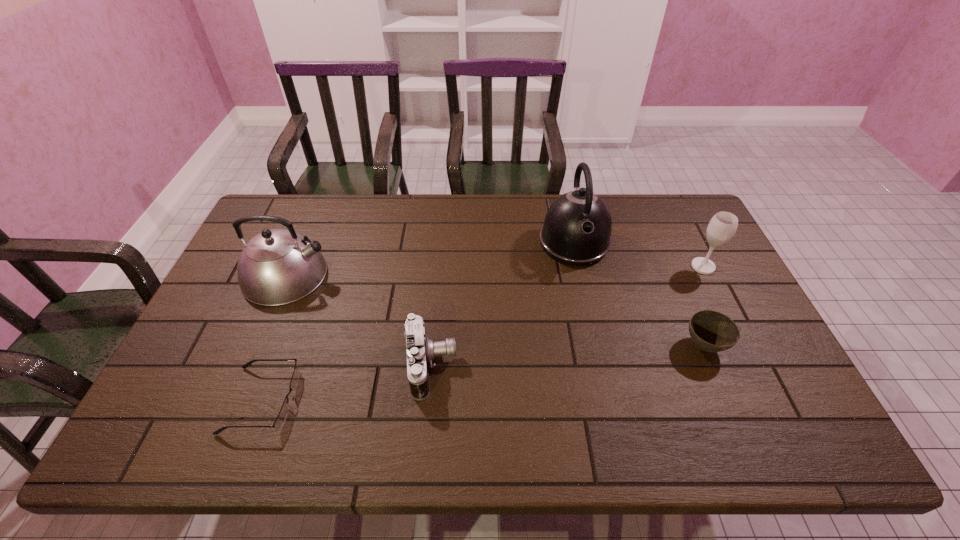
In order to click on vacant space situated 0.400m on the spout of the taller kettle in this screenshot , I will do `click(606, 385)`.

Locate an element on the screen. This screenshot has width=960, height=540. vacant space located 0.180m from the spout of the left kettle is located at coordinates (389, 275).

Where is `vacant space situated 0.110m on the front of the rightmost object`? This screenshot has height=540, width=960. vacant space situated 0.110m on the front of the rightmost object is located at coordinates (721, 302).

In order to click on vacant region located at the lens of the camera in this screenshot , I will do `click(476, 366)`.

Locate an element on the screen. This screenshot has width=960, height=540. blank area located 0.340m on the left of the bowl is located at coordinates (553, 346).

You are a GUI agent. You are given a task and a screenshot of the screen. Output one action in this format:
    pyautogui.click(x=<x>, y=<y>)
    Task: Click on the vacant space located on the front-facing side of the shortest object
    The width and height of the screenshot is (960, 540).
    Given the screenshot: What is the action you would take?
    pyautogui.click(x=316, y=400)

What are the coordinates of `object present at the far edge` in the screenshot? It's located at (577, 228).

Locate an element on the screen. This screenshot has width=960, height=540. object that is at the near edge is located at coordinates (282, 416).

What are the coordinates of `kettle that is at the left edge` in the screenshot? It's located at (278, 266).

Locate an element on the screen. This screenshot has width=960, height=540. spectacles located in the left edge section of the desktop is located at coordinates (282, 416).